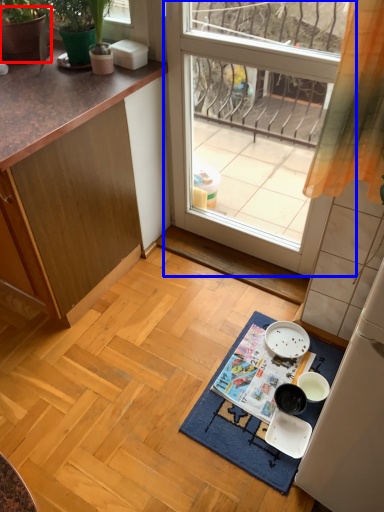
Question: Which object is closer to the camera taking this photo, flowerpot (highlighted by a red box) or window (highlighted by a blue box)?

Choices:
 (A) flowerpot
 (B) window

Answer: (B)